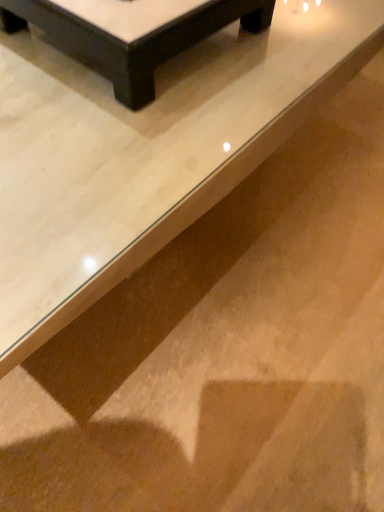
Question: Is white glossy table at upper center, which is counted as the first table, starting from the front, positioned behind black glossy table at upper center, the second table when ordered from front to back?

Choices:
 (A) no
 (B) yes

Answer: (A)

Question: From a real-world perspective, is white glossy table at upper center, which is the second table from back to front, on top of black glossy table at upper center, the second table when ordered from front to back?

Choices:
 (A) yes
 (B) no

Answer: (B)

Question: Is white glossy table at upper center, which is the second table from back to front, directly adjacent to black glossy table at upper center, the second table when ordered from front to back?

Choices:
 (A) yes
 (B) no

Answer: (B)

Question: From the image's perspective, is white glossy table at upper center, which is the second table from back to front, located beneath black glossy table at upper center, which is counted as the first table, starting from the back?

Choices:
 (A) yes
 (B) no

Answer: (A)

Question: Can you confirm if white glossy table at upper center, which is the second table from back to front, is smaller than black glossy table at upper center, which is counted as the first table, starting from the back?

Choices:
 (A) no
 (B) yes

Answer: (A)

Question: Can you confirm if white glossy table at upper center, which is the second table from back to front, is wider than black glossy table at upper center, which is counted as the first table, starting from the back?

Choices:
 (A) no
 (B) yes

Answer: (B)

Question: Is black glossy table at upper center, which is counted as the first table, starting from the back, bigger than white glossy table at upper center, which is counted as the first table, starting from the front?

Choices:
 (A) no
 (B) yes

Answer: (A)

Question: Does black glossy table at upper center, which is counted as the first table, starting from the back, touch white glossy table at upper center, which is the second table from back to front?

Choices:
 (A) no
 (B) yes

Answer: (A)

Question: Is black glossy table at upper center, the second table when ordered from front to back, far away from white glossy table at upper center, which is counted as the first table, starting from the front?

Choices:
 (A) yes
 (B) no

Answer: (B)

Question: From the image's perspective, is black glossy table at upper center, which is counted as the first table, starting from the back, above white glossy table at upper center, which is counted as the first table, starting from the front?

Choices:
 (A) no
 (B) yes

Answer: (B)

Question: Can we say black glossy table at upper center, which is counted as the first table, starting from the back, lies outside white glossy table at upper center, which is the second table from back to front?

Choices:
 (A) no
 (B) yes

Answer: (B)

Question: Does black glossy table at upper center, which is counted as the first table, starting from the back, have a greater height compared to white glossy table at upper center, which is the second table from back to front?

Choices:
 (A) yes
 (B) no

Answer: (B)

Question: Is white glossy table at upper center, which is counted as the first table, starting from the front, taller or shorter than black glossy table at upper center, which is counted as the first table, starting from the back?

Choices:
 (A) tall
 (B) short

Answer: (A)